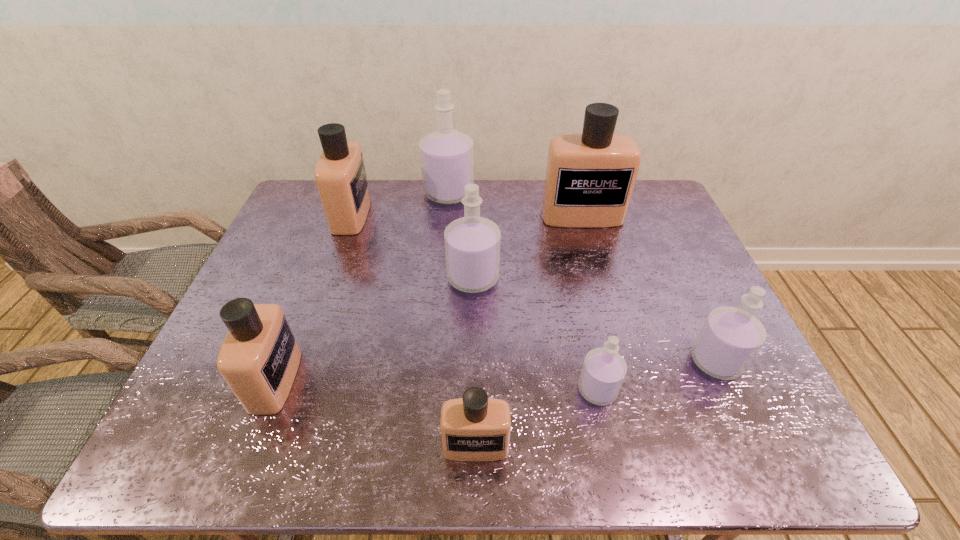
The height and width of the screenshot is (540, 960). Find the location of `object that is at the far left corner`. object that is at the far left corner is located at coordinates (340, 175).

In the image, there is a desktop. Identify the location of free region at the far edge. Image resolution: width=960 pixels, height=540 pixels. (498, 206).

In order to click on vacant space at the near edge in this screenshot , I will do `click(580, 447)`.

The width and height of the screenshot is (960, 540). Find the location of `vacant space at the left edge of the desktop`. vacant space at the left edge of the desktop is located at coordinates (296, 259).

The width and height of the screenshot is (960, 540). What are the coordinates of `vacant region at the right edge` in the screenshot? It's located at (670, 305).

Where is `free space at the far right corner of the desktop`? Image resolution: width=960 pixels, height=540 pixels. free space at the far right corner of the desktop is located at coordinates (664, 209).

Find the location of a particular element. This screenshot has width=960, height=540. empty space between the second biggest beige perfume and the fourth farthest object is located at coordinates (413, 246).

Where is `free space that is in between the rightmost beige perfume and the nearest object`? Image resolution: width=960 pixels, height=540 pixels. free space that is in between the rightmost beige perfume and the nearest object is located at coordinates (529, 331).

You are a GUI agent. You are given a task and a screenshot of the screen. Output one action in this format:
    pyautogui.click(x=<x>, y=<y>)
    Task: Click on the vacant point located between the third biggest beige perfume and the third nearest purple perfume
    The height and width of the screenshot is (540, 960).
    Given the screenshot: What is the action you would take?
    pyautogui.click(x=374, y=329)

Where is `free space between the biggest beige perfume and the farthest purple perfume`? free space between the biggest beige perfume and the farthest purple perfume is located at coordinates (516, 205).